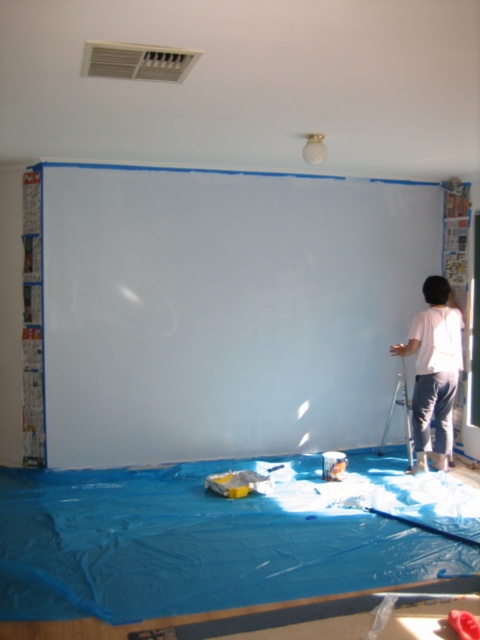
Measure the distance between point (x=412, y=412) and camera.

Point (x=412, y=412) is 4.77 meters from camera.

Does white cotton shirt at right have a lesser width compared to metallic silver ladder at right?

Incorrect, white cotton shirt at right's width is not less than metallic silver ladder at right's.

The width and height of the screenshot is (480, 640). What are the coordinates of `white cotton shirt at right` in the screenshot? It's located at (433, 371).

Can you confirm if white matte wall at center is smaller than metallic silver ladder at right?

Actually, white matte wall at center might be larger than metallic silver ladder at right.

The image size is (480, 640). I want to click on white matte wall at center, so click(x=224, y=308).

Does white matte wall at center have a smaller size compared to white cotton shirt at right?

Incorrect, white matte wall at center is not smaller in size than white cotton shirt at right.

Which is more to the left, white matte wall at center or white cotton shirt at right?

white matte wall at center

Is point (420, 192) positioned in front of point (447, 346)?

No, it is not.

Locate an element on the screen. The height and width of the screenshot is (640, 480). white matte wall at center is located at coordinates (224, 308).